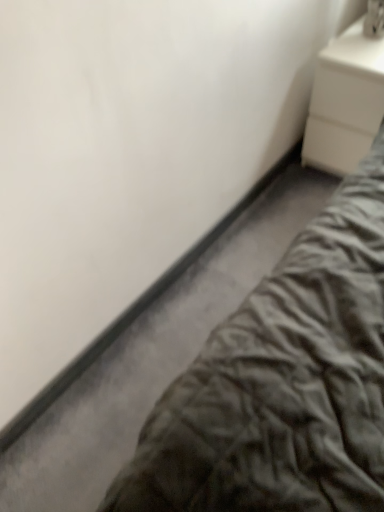
Question: Should I look upward or downward to see white matte nightstand at upper right?

Choices:
 (A) down
 (B) up

Answer: (B)

Question: Can you confirm if velvet gray bed at lower right is thinner than white matte nightstand at upper right?

Choices:
 (A) no
 (B) yes

Answer: (A)

Question: Can you confirm if velvet gray bed at lower right is wider than white matte nightstand at upper right?

Choices:
 (A) no
 (B) yes

Answer: (B)

Question: From the image's perspective, is velvet gray bed at lower right under white matte nightstand at upper right?

Choices:
 (A) yes
 (B) no

Answer: (A)

Question: Is velvet gray bed at lower right completely or partially outside of white matte nightstand at upper right?

Choices:
 (A) yes
 (B) no

Answer: (A)

Question: From a real-world perspective, is velvet gray bed at lower right beneath white matte nightstand at upper right?

Choices:
 (A) yes
 (B) no

Answer: (A)

Question: Does velvet gray bed at lower right lie in front of white matte nightstand at upper right?

Choices:
 (A) no
 (B) yes

Answer: (B)

Question: Does white matte nightstand at upper right have a greater width compared to velvet gray bed at lower right?

Choices:
 (A) yes
 (B) no

Answer: (B)

Question: From a real-world perspective, does white matte nightstand at upper right sit lower than velvet gray bed at lower right?

Choices:
 (A) no
 (B) yes

Answer: (A)

Question: From the image's perspective, does white matte nightstand at upper right appear lower than velvet gray bed at lower right?

Choices:
 (A) yes
 (B) no

Answer: (B)

Question: Is white matte nightstand at upper right closer to camera compared to velvet gray bed at lower right?

Choices:
 (A) yes
 (B) no

Answer: (B)

Question: Could you tell me if white matte nightstand at upper right is facing velvet gray bed at lower right?

Choices:
 (A) yes
 (B) no

Answer: (A)

Question: Can you confirm if white matte nightstand at upper right is positioned to the right of velvet gray bed at lower right?

Choices:
 (A) yes
 (B) no

Answer: (A)

Question: In the image, is velvet gray bed at lower right positioned in front of or behind white matte nightstand at upper right?

Choices:
 (A) behind
 (B) front

Answer: (B)